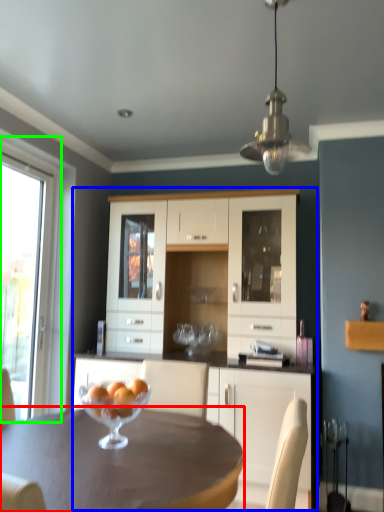
Question: Which object is the farthest from desk (highlighted by a red box)? Choose among these: cupboard (highlighted by a blue box) or window (highlighted by a green box).

Choices:
 (A) cupboard
 (B) window

Answer: (B)